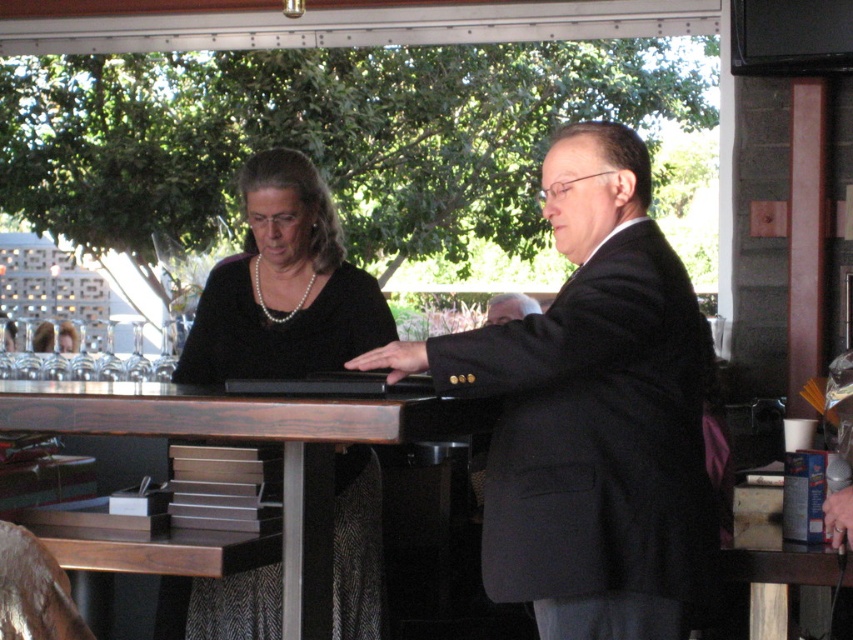
Question: Does black pearl necklace at center lie in front of matte black laptop at center?

Choices:
 (A) no
 (B) yes

Answer: (A)

Question: Is black pearl necklace at center bigger than matte black laptop at center?

Choices:
 (A) no
 (B) yes

Answer: (B)

Question: Which object is positioned farthest from the dark wood table at center?

Choices:
 (A) black wool suit at right
 (B) matte black laptop at center

Answer: (A)

Question: Considering the relative positions of black pearl necklace at center and dark wood table at center in the image provided, where is black pearl necklace at center located with respect to dark wood table at center?

Choices:
 (A) right
 (B) left

Answer: (A)

Question: Which point is closer to the camera?

Choices:
 (A) matte black laptop at center
 (B) dark wood table at center
 (C) black matte suit at center

Answer: (C)

Question: Which object is positioned farthest from the black pearl necklace at center?

Choices:
 (A) black matte suit at center
 (B) black wool suit at right
 (C) dark wood table at center
 (D) matte black laptop at center

Answer: (B)